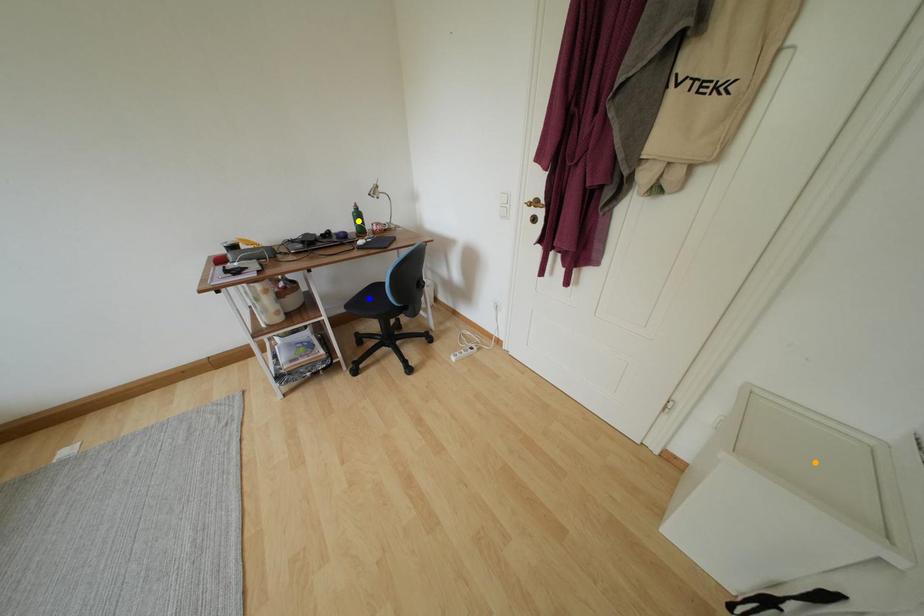
Order these from nearest to farthest:
yellow point | blue point | orange point

orange point < yellow point < blue point